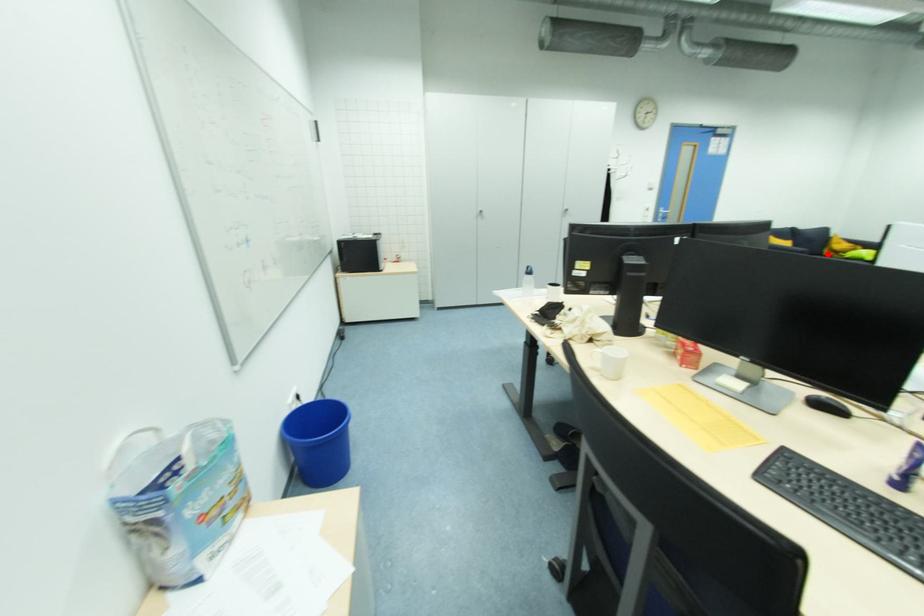
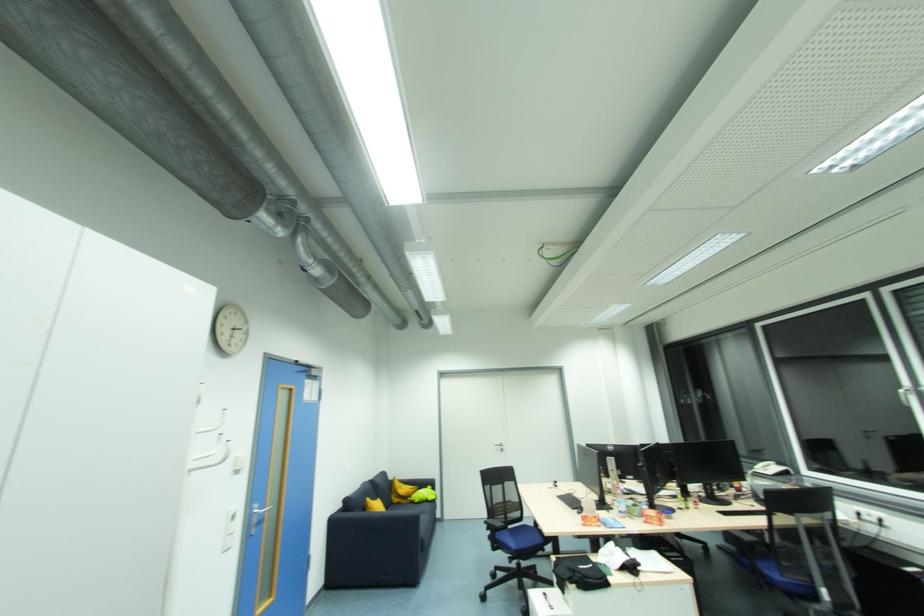
Question: A red point is marked in image1. In image2, is the corresponding 3D point closer to the camera or farther? Reply with the corresponding letter.

Choices:
 (A) The corresponding 3D point is closer.
 (B) The corresponding 3D point is farther.

Answer: (A)